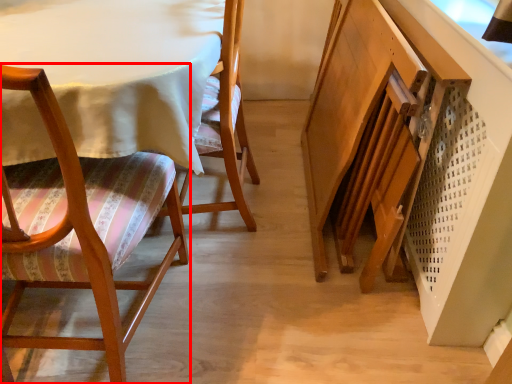
Question: In this image, where is chair (annotated by the red box) located relative to chair?

Choices:
 (A) left
 (B) right

Answer: (A)